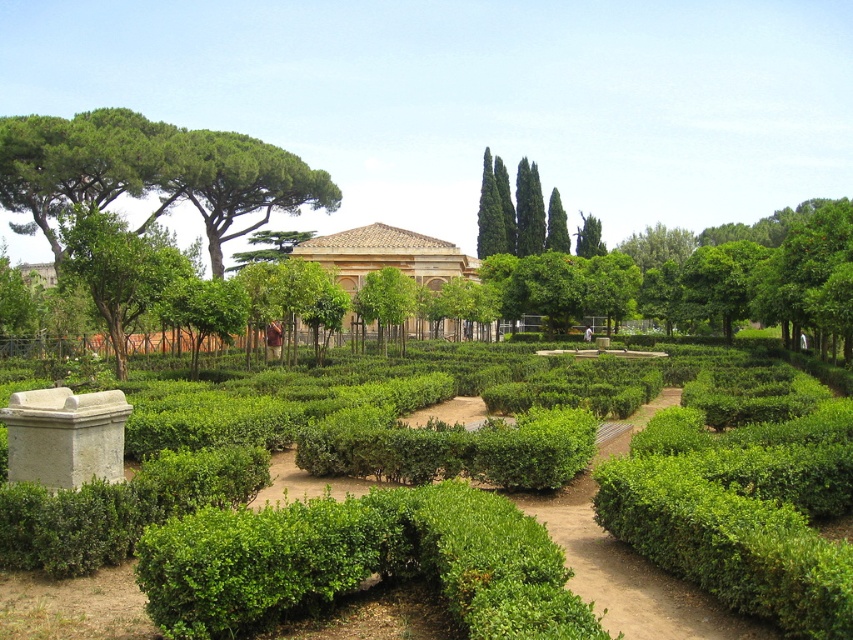
You are a gardener planning to plant a new tree that requires a space 2 meters wide. You see the green leafy tree at upper left and the brown stone building at center. Which location would be suitable for planting the new tree?

The green leafy tree at upper left is thinner than the brown stone building at center, so the area around the green leafy tree at upper left would be suitable for planting the new tree since it requires a space 2 meters wide.

You are standing at the entrance of the garden and see two points marked in the image. The first point is at coordinates point (250, 182) and the second point is at point (387, 248). Which point is closer to you?

Point (250, 182) is in front of point (387, 248), so it is closer to you.

You are standing at the center of the garden and want to locate the green leafy tree at upper left. Based on the coordinates provided, in which direction should you look to find it?

The green leafy tree at upper left is located at point coordinates that are to the left and upper part of the garden, so you should look towards the upper left direction to find it.